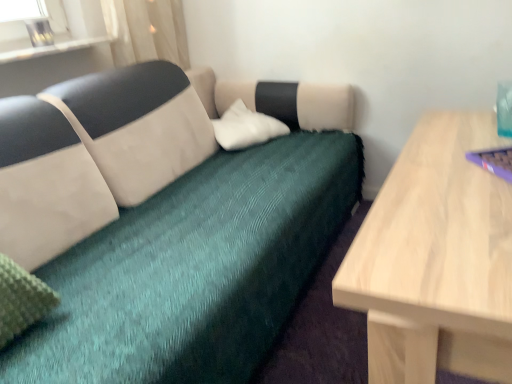
The width and height of the screenshot is (512, 384). What do you see at coordinates (160, 228) in the screenshot? I see `teal fabric couch at center` at bounding box center [160, 228].

Locate an element on the screen. teal fabric couch at center is located at coordinates (160, 228).

Identify the location of white soft pillow at center. (245, 127).

Locate an element on the screen. The image size is (512, 384). clear glass vase at upper left is located at coordinates (39, 32).

Where is `curtain above the white soft pillow at center (from the image's perspective)`? curtain above the white soft pillow at center (from the image's perspective) is located at coordinates [146, 31].

Looking at this image, is white soft pillow at center smaller than sheer white curtain at upper left?

Yes.

In terms of height, does white soft pillow at center look taller or shorter compared to sheer white curtain at upper left?

Clearly, white soft pillow at center is shorter compared to sheer white curtain at upper left.

Does white soft pillow at center contain sheer white curtain at upper left?

No, sheer white curtain at upper left is not a part of white soft pillow at center.

Can you confirm if purple plastic laptop at right is taller than teal fabric couch at center?

Incorrect, the height of purple plastic laptop at right is not larger of that of teal fabric couch at center.

From the image's perspective, between purple plastic laptop at right and teal fabric couch at center, who is located below?

teal fabric couch at center.

From the picture: Is purple plastic laptop at right placed right next to teal fabric couch at center?

No, purple plastic laptop at right is not next to teal fabric couch at center.

Choose the correct answer: Is white soft pillow at center inside clear glass vase at upper left or outside it?

white soft pillow at center is outside clear glass vase at upper left.

How different are the orientations of white soft pillow at center and clear glass vase at upper left in degrees?

There is a 0.0884-degree angle between the facing directions of white soft pillow at center and clear glass vase at upper left.

From the image's perspective, would you say white soft pillow at center is positioned over clear glass vase at upper left?

Actually, white soft pillow at center appears below clear glass vase at upper left in the image.

Is white soft pillow at center shorter than clear glass vase at upper left?

No.

Can you tell me how much white soft pillow at center and teal fabric couch at center differ in facing direction?

The angular difference between white soft pillow at center and teal fabric couch at center is 0.000853 degrees.

Which object is closer to the camera, white soft pillow at center or teal fabric couch at center?

Positioned in front is teal fabric couch at center.

In the scene shown: Can you confirm if white soft pillow at center is wider than teal fabric couch at center?

No.

Does sheer white curtain at upper left turn towards white soft pillow at center?

No, sheer white curtain at upper left is not turned towards white soft pillow at center.

Which object is further away from the camera, sheer white curtain at upper left or white soft pillow at center?

Positioned behind is sheer white curtain at upper left.

I want to click on curtain above the white soft pillow at center (from the image's perspective), so click(x=146, y=31).

From a real-world perspective, does sheer white curtain at upper left stand above white soft pillow at center?

Yes, from a real-world perspective, sheer white curtain at upper left is above white soft pillow at center.

Would you say clear glass vase at upper left contains purple plastic laptop at right?

That's incorrect, purple plastic laptop at right is not inside clear glass vase at upper left.

Which is closer to the camera, (40, 28) or (493, 165)?

Point (40, 28) appears to be farther away from the viewer than point (493, 165).

Considering the sizes of objects clear glass vase at upper left and white soft pillow at center in the image provided, who is bigger, clear glass vase at upper left or white soft pillow at center?

white soft pillow at center is bigger.

Is clear glass vase at upper left outside of white soft pillow at center?

clear glass vase at upper left lies outside white soft pillow at center's area.

Does clear glass vase at upper left lie behind white soft pillow at center?

No.

Which object is positioned more to the right, clear glass vase at upper left or white soft pillow at center?

white soft pillow at center.

Image resolution: width=512 pixels, height=384 pixels. Find the location of `pillow that is below the sheer white curtain at upper left (from the image's perspective)`. pillow that is below the sheer white curtain at upper left (from the image's perspective) is located at coordinates (245, 127).

Image resolution: width=512 pixels, height=384 pixels. I want to click on laptop above the teal fabric couch at center (from a real-world perspective), so click(494, 161).

Estimate the real-world distances between objects in this image. Which object is closer to clear glass vase at upper left, sheer white curtain at upper left or purple plastic laptop at right?

sheer white curtain at upper left.

Considering their positions, is clear glass vase at upper left positioned closer to purple plastic laptop at right than teal fabric couch at center?

teal fabric couch at center is closer to purple plastic laptop at right.

Considering their positions, is white soft pillow at center positioned further to clear glass vase at upper left than teal fabric couch at center?

white soft pillow at center lies further to clear glass vase at upper left than the other object.

Looking at the image, which one is located closer to teal fabric couch at center, clear glass vase at upper left or sheer white curtain at upper left?

sheer white curtain at upper left is closer to teal fabric couch at center.

Looking at the image, which one is located closer to teal fabric couch at center, sheer white curtain at upper left or white soft pillow at center?

Based on the image, white soft pillow at center appears to be nearer to teal fabric couch at center.

Based on their spatial positions, is white soft pillow at center or teal fabric couch at center further from purple plastic laptop at right?

white soft pillow at center is further to purple plastic laptop at right.

Which object lies nearer to the anchor point white soft pillow at center, clear glass vase at upper left or purple plastic laptop at right?

Based on the image, clear glass vase at upper left appears to be nearer to white soft pillow at center.

Based on their spatial positions, is purple plastic laptop at right or sheer white curtain at upper left closer to clear glass vase at upper left?

Based on the image, sheer white curtain at upper left appears to be nearer to clear glass vase at upper left.

Find the location of a particular element. The image size is (512, 384). glass vase between teal fabric couch at center and white soft pillow at center from front to back is located at coordinates (39, 32).

Locate an element on the screen. studio couch between clear glass vase at upper left and purple plastic laptop at right in the horizontal direction is located at coordinates (160, 228).

Identify the location of pillow positioned between teal fabric couch at center and sheer white curtain at upper left from near to far. This screenshot has height=384, width=512. (245, 127).

At what (x,y) coordinates should I click in order to perform the action: click on pillow located between sheer white curtain at upper left and purple plastic laptop at right in the left-right direction. Please return your answer as a coordinate pair (x, y). The image size is (512, 384). Looking at the image, I should click on point(245,127).